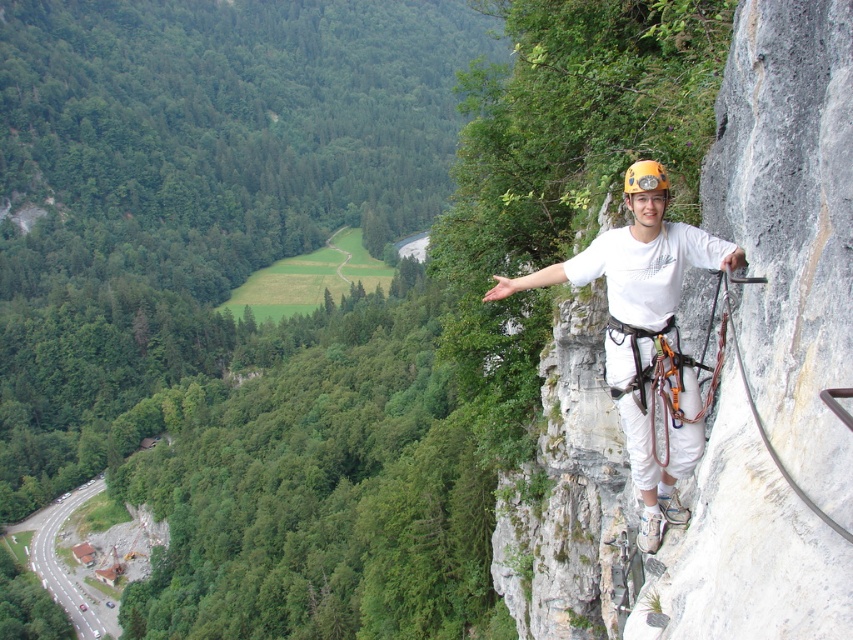
Question: Which object is closer to the camera taking this photo?

Choices:
 (A) white matte helmet at upper right
 (B) yellow matte helmet at upper right

Answer: (B)

Question: Can you confirm if white matte helmet at upper right is wider than yellow matte helmet at upper right?

Choices:
 (A) no
 (B) yes

Answer: (B)

Question: Is white matte helmet at upper right below yellow matte helmet at upper right?

Choices:
 (A) yes
 (B) no

Answer: (A)

Question: Can you confirm if white matte helmet at upper right is smaller than yellow matte helmet at upper right?

Choices:
 (A) no
 (B) yes

Answer: (A)

Question: Which point is closer to the camera?

Choices:
 (A) yellow matte helmet at upper right
 (B) white matte helmet at upper right

Answer: (A)